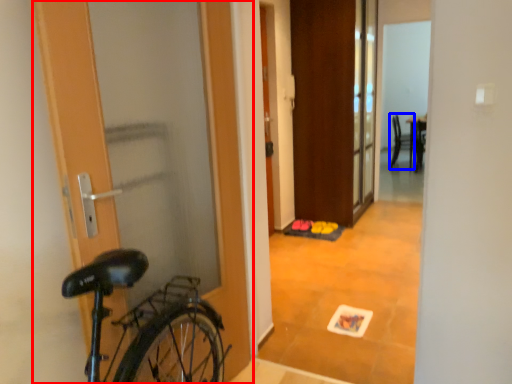
Question: Which point is closer to the camera, door (highlighted by a red box) or chair (highlighted by a blue box)?

Choices:
 (A) door
 (B) chair

Answer: (A)